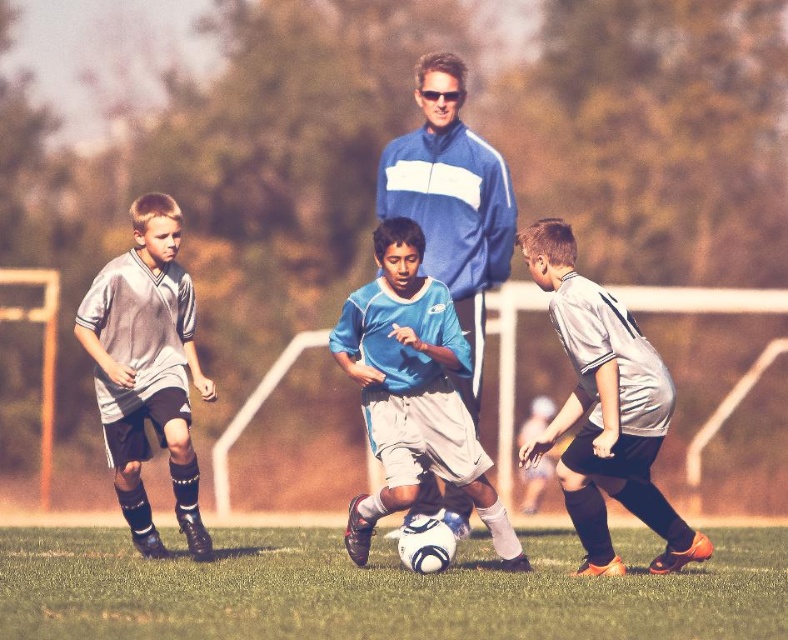
Question: Is blue matte soccer ball at center to the right of gray matte soccer jersey at left from the viewer's perspective?

Choices:
 (A) no
 (B) yes

Answer: (B)

Question: In this image, where is white matte soccer ball at center located relative to gray matte soccer jersey at left?

Choices:
 (A) right
 (B) left

Answer: (A)

Question: Which of the following is the farthest from the observer?

Choices:
 (A) (455, 257)
 (B) (458, 435)

Answer: (A)

Question: Which point is closer to the camera?

Choices:
 (A) blue matte soccer ball at center
 (B) blue fabric jacket at center
 (C) gray matte soccer jersey at left
 (D) white matte soccer ball at center

Answer: (A)

Question: Is white matte soccer ball at center bigger than gray matte jersey at right?

Choices:
 (A) yes
 (B) no

Answer: (A)

Question: Which point appears closest to the camera in this image?

Choices:
 (A) (426, 413)
 (B) (536, 449)
 (C) (433, 177)

Answer: (A)